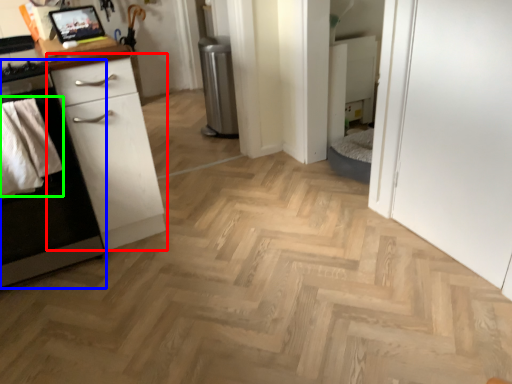
Question: Which is nearer to the chest of drawers (highlighted by a red box)? cabinetry (highlighted by a blue box) or material (highlighted by a green box).

Choices:
 (A) cabinetry
 (B) material

Answer: (A)